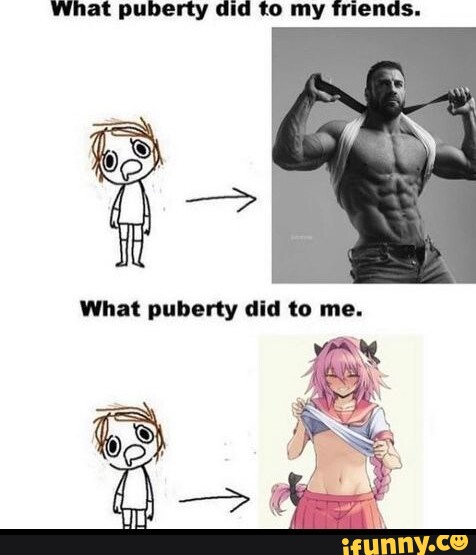
The image size is (476, 555). Identify the location of chest. (385, 150).